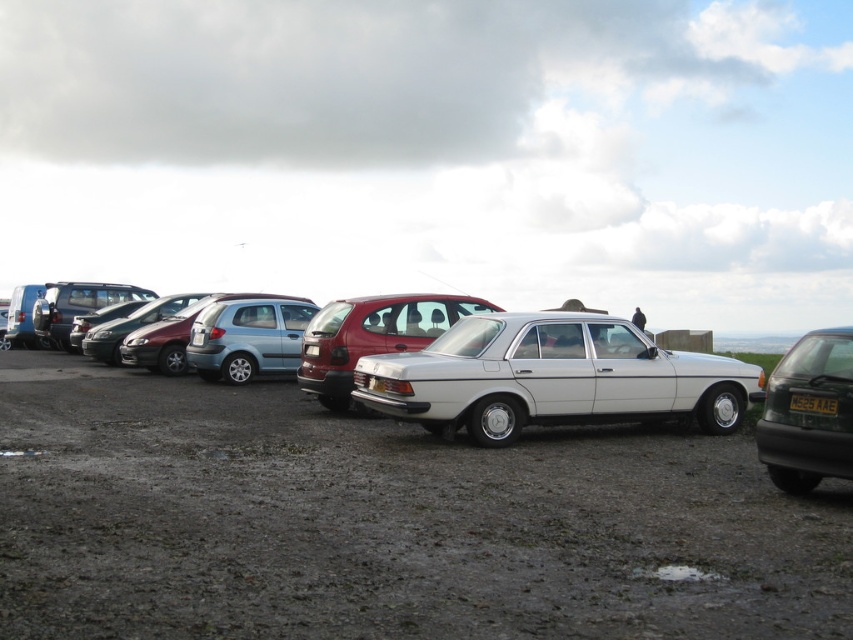
Which is above, matte black car at right or metallic blue sedan at center?

metallic blue sedan at center is higher up.

Is point (766, 394) behind point (212, 339)?

No.

Describe the element at coordinates (808, 412) in the screenshot. I see `matte black car at right` at that location.

Identify the location of matte black car at right. This screenshot has width=853, height=640. click(x=808, y=412).

Which is above, metallic red hatchback at center or metallic blue sedan at center?

metallic red hatchback at center is higher up.

Is metallic red hatchback at center positioned at the back of metallic blue sedan at center?

No.

Which is in front, point (368, 337) or point (228, 300)?

Point (368, 337)

Locate an element on the screen. Image resolution: width=853 pixels, height=640 pixels. metallic red hatchback at center is located at coordinates (372, 337).

Measure the distance between dirt track at center and camera.

The distance of dirt track at center from camera is 11.81 feet.

Can you confirm if dirt track at center is thinner than matte black car at right?

No.

The width and height of the screenshot is (853, 640). I want to click on dirt track at center, so click(x=386, y=522).